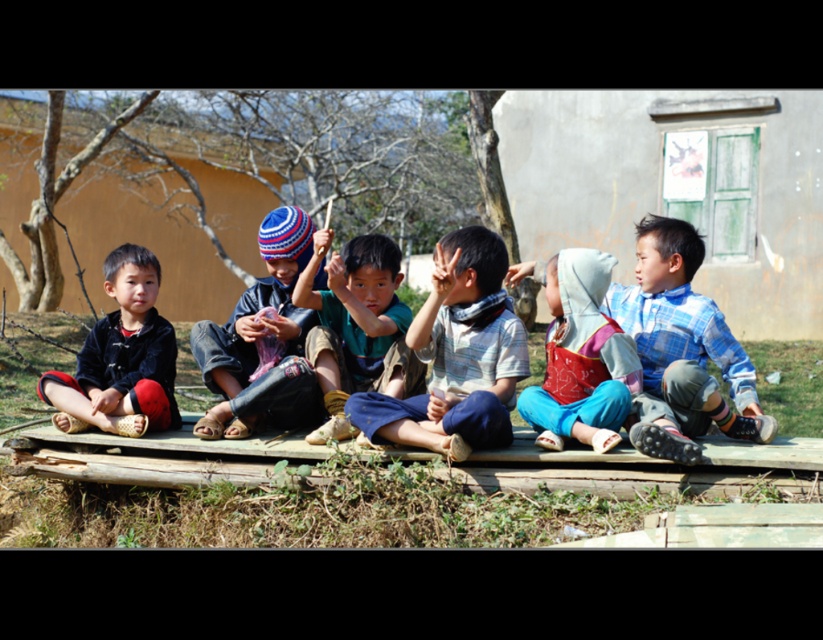
Is the position of knitted woolen cap at center more distant than that of matte black pants at left?

No, it is in front of matte black pants at left.

You are a GUI agent. You are given a task and a screenshot of the screen. Output one action in this format:
    pyautogui.click(x=<x>, y=<y>)
    Task: Click on the knitted woolen cap at center
    The width and height of the screenshot is (823, 640).
    Given the screenshot: What is the action you would take?
    pyautogui.click(x=261, y=340)

Where is `knitted woolen cap at center`? Image resolution: width=823 pixels, height=640 pixels. knitted woolen cap at center is located at coordinates (261, 340).

How far apart are blue plaid shirt at right and matte black pants at left?

4.82 meters

Identify the location of blue plaid shirt at right. (681, 349).

Describe the element at coordinates (681, 349) in the screenshot. I see `blue plaid shirt at right` at that location.

Locate an element on the screen. blue plaid shirt at right is located at coordinates (681, 349).

Can you confirm if light blue cotton shirt at center is positioned to the right of blue plaid shirt at right?

Incorrect, light blue cotton shirt at center is not on the right side of blue plaid shirt at right.

Based on the photo, between light blue cotton shirt at center and blue plaid shirt at right, which one appears on the right side from the viewer's perspective?

blue plaid shirt at right

Who is more forward, (393, 433) or (733, 416)?

Point (393, 433) is in front.

At what (x,y) coordinates should I click in order to perform the action: click on light blue cotton shirt at center. Please return your answer as a coordinate pair (x, y). The image size is (823, 640). Looking at the image, I should click on (456, 355).